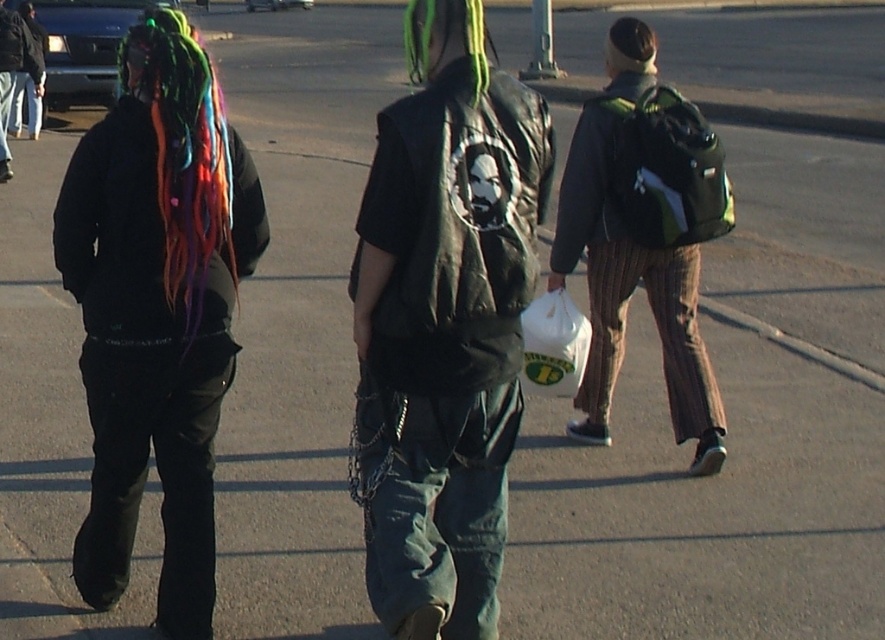
Question: Can you confirm if multicolored braided hair at left is positioned to the right of white plastic bag at center?

Choices:
 (A) no
 (B) yes

Answer: (A)

Question: Which of the following is the farthest from the observer?

Choices:
 (A) black matte jacket at left
 (B) green dyed hair at center
 (C) leather vest at center
 (D) multicolored braided hair at left

Answer: (A)

Question: Is striped fabric pants at center further to the viewer compared to white plastic bag at center?

Choices:
 (A) yes
 (B) no

Answer: (B)

Question: Which object is the farthest from the striped fabric pants at center?

Choices:
 (A) multicolored braided hair at left
 (B) white plastic bag at center
 (C) leather vest at center

Answer: (A)

Question: Does leather vest at center have a lesser width compared to striped fabric pants at center?

Choices:
 (A) no
 (B) yes

Answer: (B)

Question: Which object is closer to the camera taking this photo?

Choices:
 (A) striped fabric pants at center
 (B) multicolored braided hair at left
 (C) green matte hair at upper center
 (D) black matte jacket at left

Answer: (B)